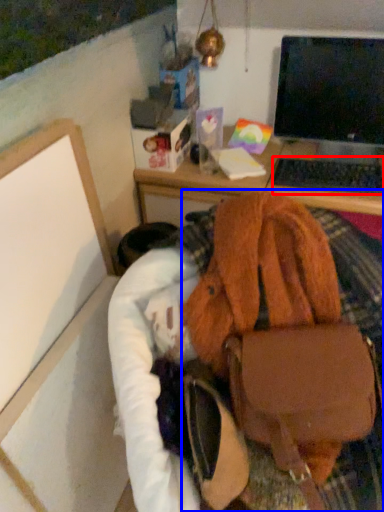
Question: Which of the following is the farthest to the observer, computer keyboard (highlighted by a red box) or handbag (highlighted by a blue box)?

Choices:
 (A) computer keyboard
 (B) handbag

Answer: (A)